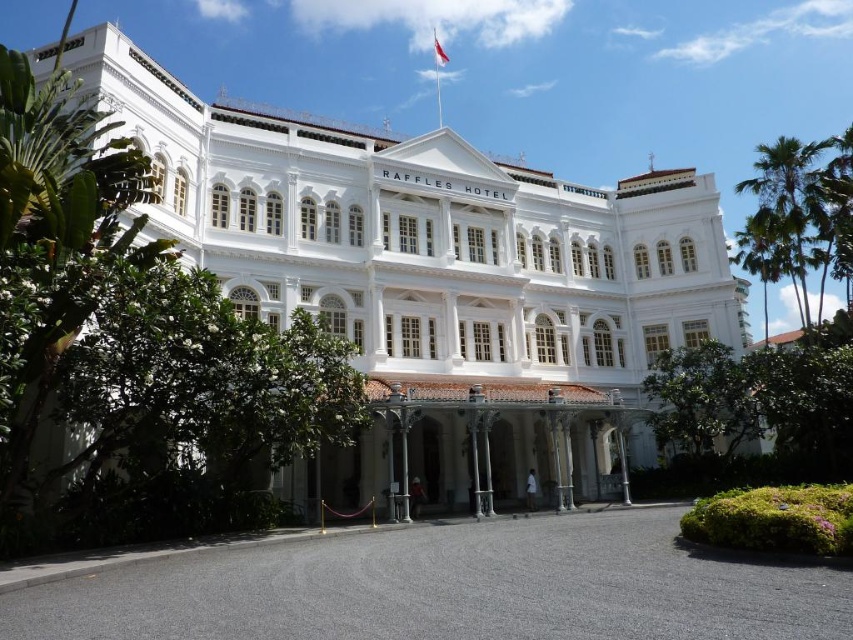
Who is taller, white stone building at center or green leafy palm tree at upper right?

white stone building at center

Which of these two, white stone building at center or green leafy palm tree at upper right, stands shorter?

Standing shorter between the two is green leafy palm tree at upper right.

Does point (221, 284) come farther from viewer compared to point (776, 264)?

No, it is not.

Identify the location of white stone building at center. This screenshot has height=640, width=853. (431, 250).